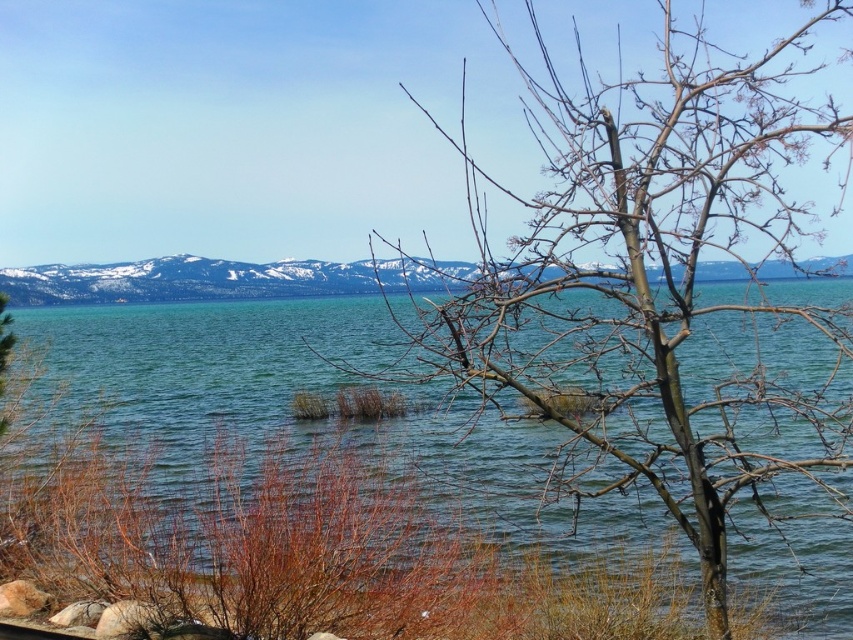
Does bare branches at center have a lesser width compared to snowy mountain at center?

Yes, bare branches at center is thinner than snowy mountain at center.

Which is below, bare branches at center or snowy mountain at center?

snowy mountain at center is lower down.

Where is `bare branches at center`? This screenshot has width=853, height=640. bare branches at center is located at coordinates (647, 275).

Find the location of `bare branches at center`. bare branches at center is located at coordinates (647, 275).

Is clear water at center thinner than snowy mountain at center?

Yes, clear water at center is thinner than snowy mountain at center.

Does clear water at center appear on the left side of snowy mountain at center?

In fact, clear water at center is to the right of snowy mountain at center.

Is point (154, 404) closer to camera compared to point (196, 280)?

That is True.

I want to click on clear water at center, so click(x=199, y=365).

Does bare branches at center have a larger size compared to clear water at center?

Yes, bare branches at center is bigger than clear water at center.

Who is more forward, (660,221) or (180,419)?

Positioned in front is point (660,221).

What do you see at coordinates (647, 275) in the screenshot? I see `bare branches at center` at bounding box center [647, 275].

You are a GUI agent. You are given a task and a screenshot of the screen. Output one action in this format:
    pyautogui.click(x=<x>, y=<y>)
    Task: Click on the bare branches at center
    Image resolution: width=853 pixels, height=640 pixels.
    Given the screenshot: What is the action you would take?
    pyautogui.click(x=647, y=275)